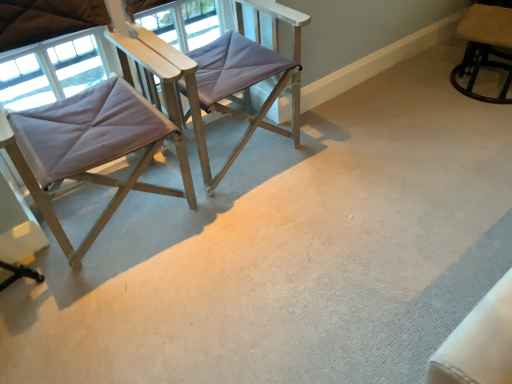
At what (x,y) coordinates should I click in order to perform the action: click on vacant space in front of matte gray fabric chair at left, marked as the first chair in a left-to-right arrangement. Please return your answer as a coordinate pair (x, y). Looking at the image, I should click on (116, 311).